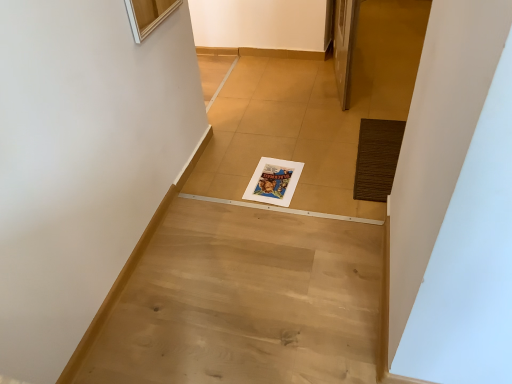
Question: Could light wood floor at center be considered to be inside white paper magazine at center?

Choices:
 (A) yes
 (B) no

Answer: (B)

Question: From a real-world perspective, is white paper magazine at center located higher than light wood floor at center?

Choices:
 (A) no
 (B) yes

Answer: (A)

Question: Considering the relative positions of white paper magazine at center and light wood floor at center in the image provided, is white paper magazine at center to the right of light wood floor at center from the viewer's perspective?

Choices:
 (A) no
 (B) yes

Answer: (B)

Question: Considering the relative sizes of white paper magazine at center and light wood floor at center in the image provided, is white paper magazine at center wider than light wood floor at center?

Choices:
 (A) no
 (B) yes

Answer: (A)

Question: Does white paper magazine at center have a greater height compared to light wood floor at center?

Choices:
 (A) yes
 (B) no

Answer: (A)

Question: From the image's perspective, would you say white paper magazine at center is shown under light wood floor at center?

Choices:
 (A) no
 (B) yes

Answer: (A)

Question: From the image's perspective, is light wood floor at center below white paper magazine at center?

Choices:
 (A) no
 (B) yes

Answer: (B)

Question: Is light wood floor at center outside white paper magazine at center?

Choices:
 (A) yes
 (B) no

Answer: (A)

Question: Would you say light wood floor at center is a long distance from white paper magazine at center?

Choices:
 (A) yes
 (B) no

Answer: (B)

Question: Is light wood floor at center directly adjacent to white paper magazine at center?

Choices:
 (A) yes
 (B) no

Answer: (B)

Question: Can you confirm if light wood floor at center is bigger than white paper magazine at center?

Choices:
 (A) no
 (B) yes

Answer: (B)

Question: Is light wood floor at center facing away from white paper magazine at center?

Choices:
 (A) no
 (B) yes

Answer: (A)

Question: Is light wood floor at center not close to brown textured mat at right?

Choices:
 (A) no
 (B) yes

Answer: (A)